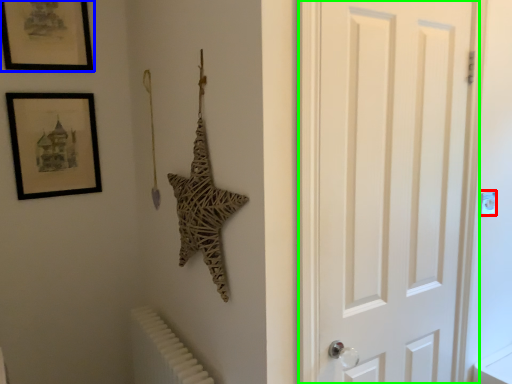
Question: Considering the real-world distances, which object is closest to light switch (highlighted by a red box)? picture frame (highlighted by a blue box) or door (highlighted by a green box).

Choices:
 (A) picture frame
 (B) door

Answer: (B)